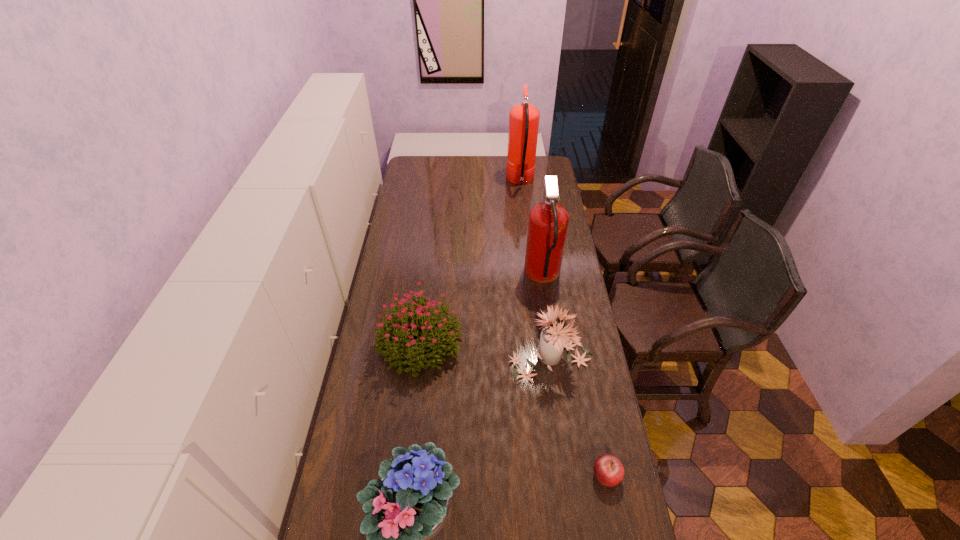
Where is `the farthest object`? The height and width of the screenshot is (540, 960). the farthest object is located at coordinates (523, 118).

What are the coordinates of `the second farthest object` in the screenshot? It's located at (548, 221).

You are a GUI agent. You are given a task and a screenshot of the screen. Output one action in this format:
    pyautogui.click(x=<x>, y=<y>)
    Task: Click on the rightmost bouquet
    
    Given the screenshot: What is the action you would take?
    pyautogui.click(x=553, y=339)

Where is `the shortest object`? the shortest object is located at coordinates (609, 471).

What are the coordinates of `blank space located towards the nozzle of the farthest object` in the screenshot? It's located at (435, 181).

Where is `free spot located 0.240m towards the nozzle of the farthest object`? This screenshot has width=960, height=540. free spot located 0.240m towards the nozzle of the farthest object is located at coordinates (464, 181).

Locate an element on the screen. The width and height of the screenshot is (960, 540). free region located towards the nozzle of the farthest object is located at coordinates (456, 181).

Where is `vacant area located 0.310m with the handle and nozzle on the fifth nearest object`? This screenshot has height=540, width=960. vacant area located 0.310m with the handle and nozzle on the fifth nearest object is located at coordinates coord(454,276).

I want to click on vacant space located with the handle and nozzle on the fifth nearest object, so click(x=456, y=276).

Identify the location of free region located with the handle and nozzle on the fifth nearest object. Image resolution: width=960 pixels, height=540 pixels. (440, 276).